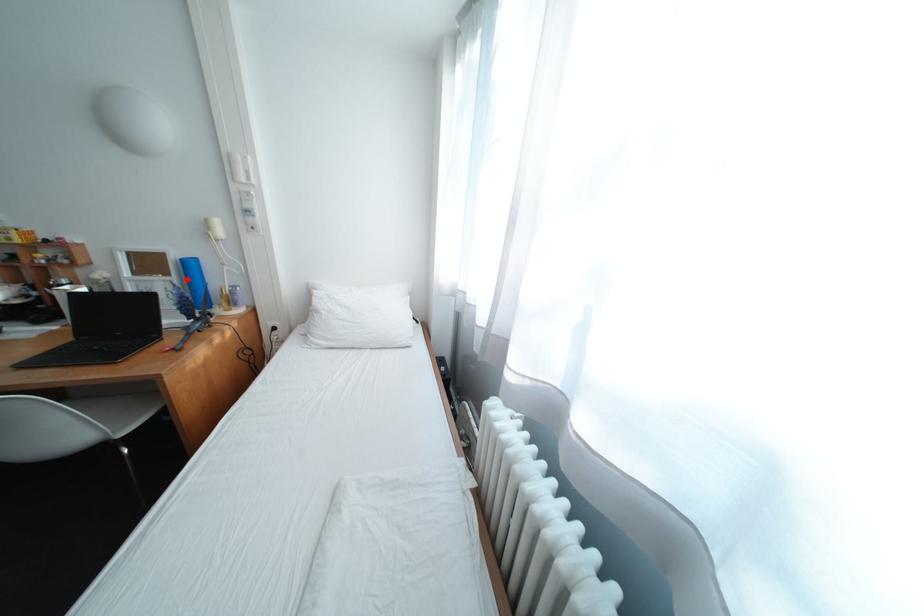
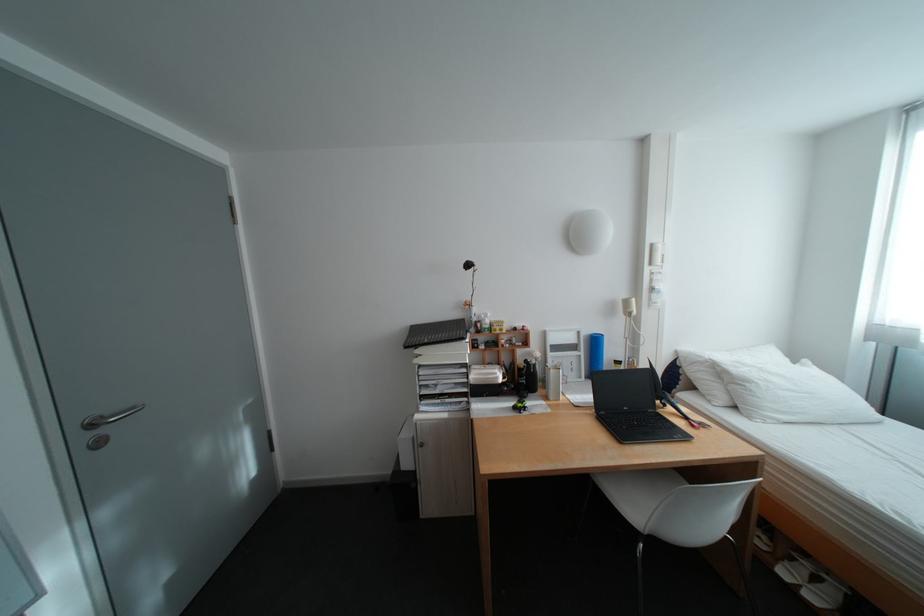
Where in the second image is the point corresponding to the highlighted location from the first image?

(594, 354)